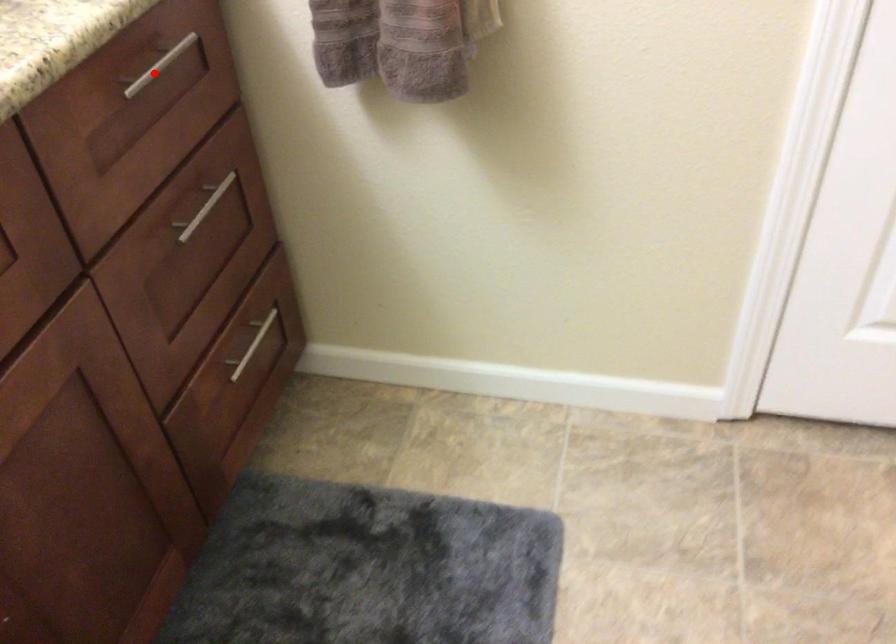
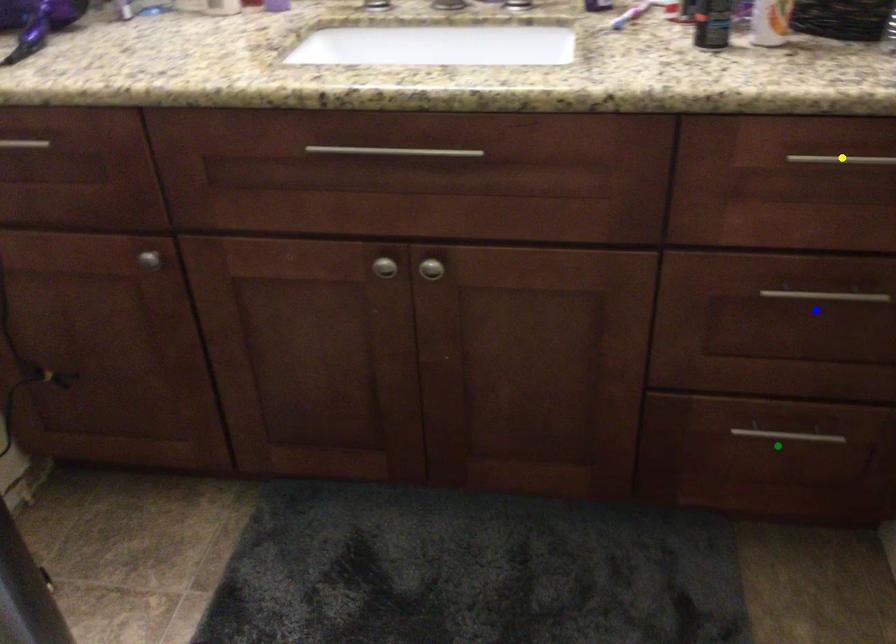
Question: I am providing you with two images of the same scene from different viewpoints. A red point is marked on the first image. You are given multiple points on the second image. Which mark in image 2 goes with the point in image 1?

Choices:
 (A) blue point
 (B) green point
 (C) yellow point

Answer: (C)